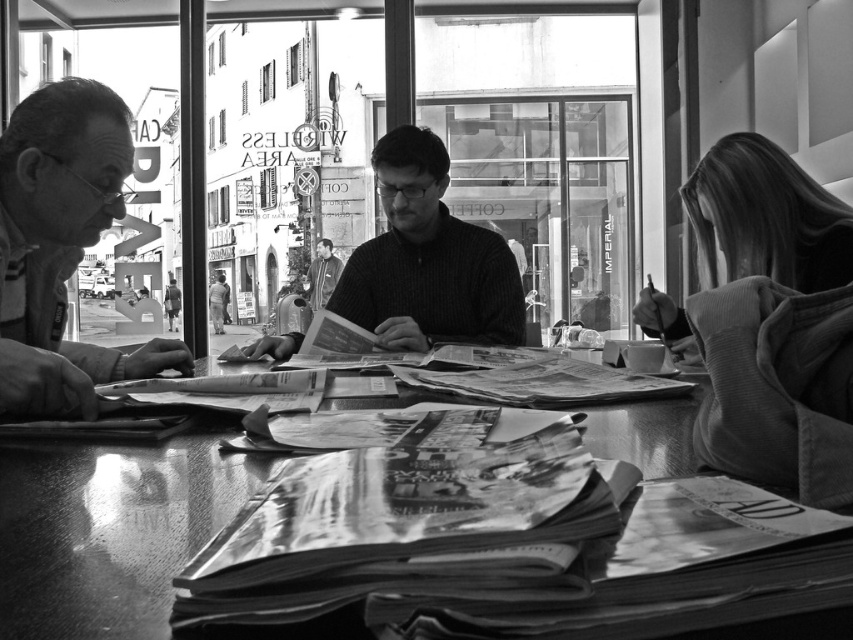
You are a photographer trying to capture a closeup of the matte black glasses at left and the smooth gray jacket at center. Which object should you zoom in on first to ensure it fills the frame without moving the camera?

The matte black glasses at left is taller than the smooth gray jacket at center, so you should zoom in on the matte black glasses at left first to ensure it fills the frame without moving the camera.

You are trying to place a small notebook on the smooth wooden table at center without covering the matte black glasses at left. Is there enough space on the table?

The smooth wooden table at center occupies less space than the matte black glasses at left, so there might not be enough space to place the notebook without covering the glasses.

You are taking a photo of the scene and want to focus on both point [32,481] and point [432,227]. Which point should you adjust your focus to first to ensure both are in sharp clarity?

Point [32,481] is closer to the camera than point [432,227]. To ensure both are in sharp clarity, focus on the closer point first, which is point [32,481].